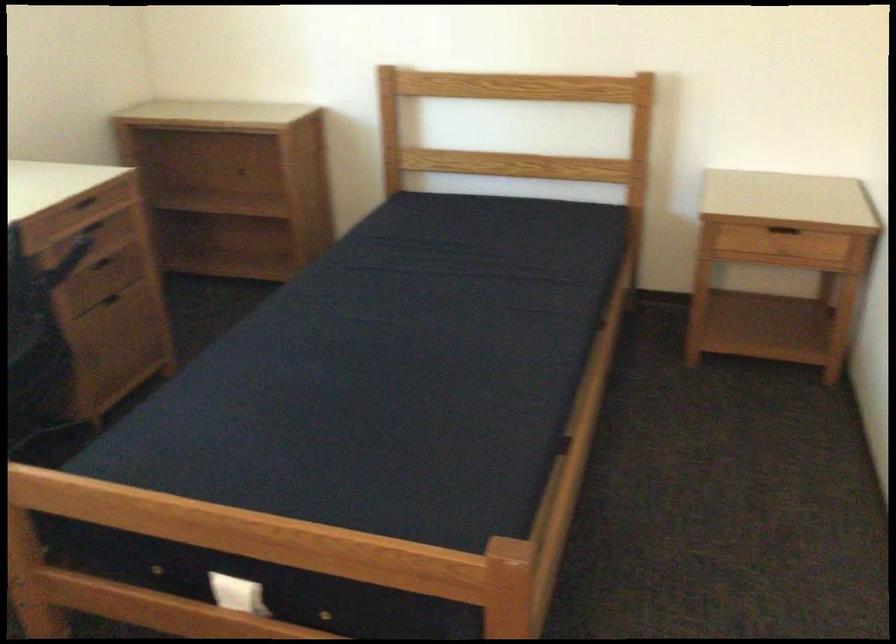
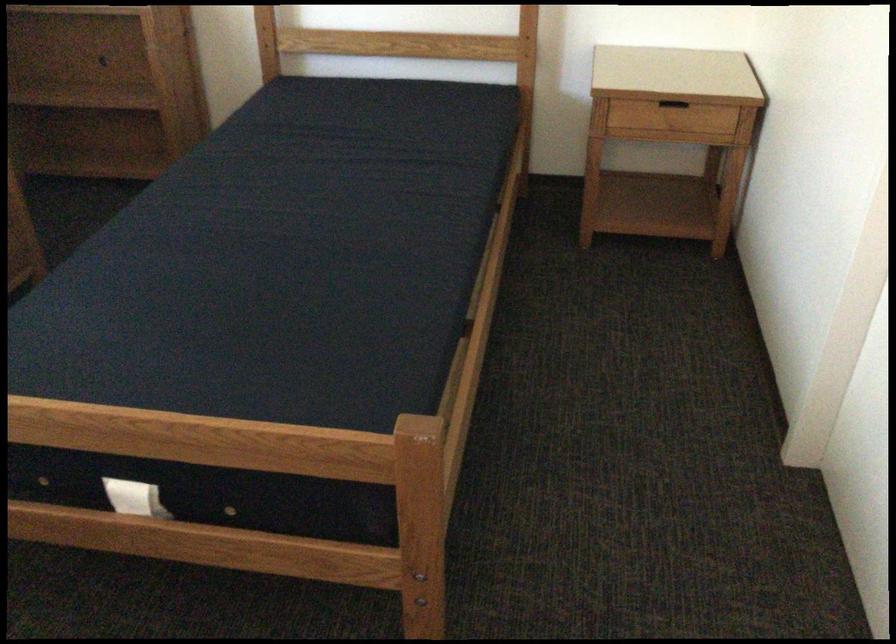
Where in the second image is the point corresponding to the point at 785,234 from the first image?

(673, 109)